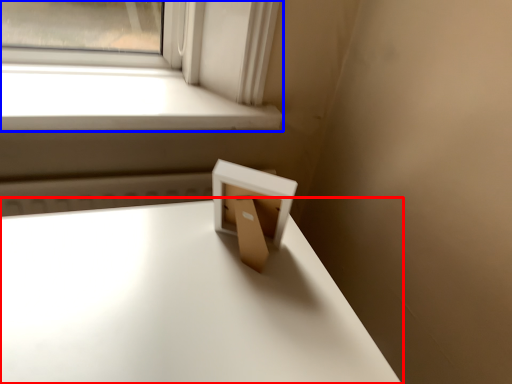
Question: Which object is closer to the camera taking this photo, table (highlighted by a red box) or window (highlighted by a blue box)?

Choices:
 (A) table
 (B) window

Answer: (A)